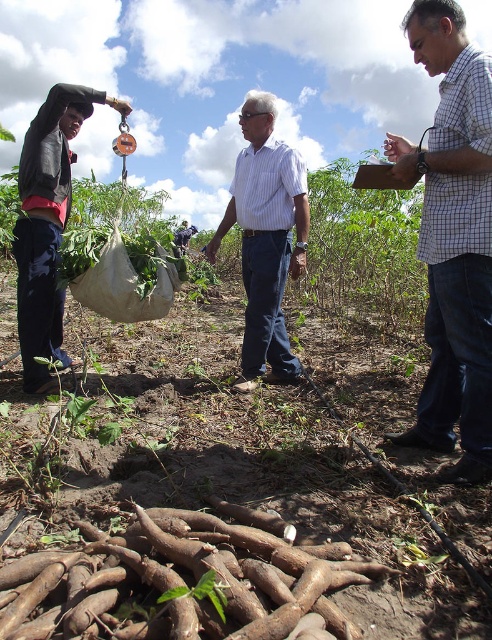
Question: Does brown rough root at lower center have a larger size compared to dark blue jeans at left?

Choices:
 (A) yes
 (B) no

Answer: (B)

Question: Which is farther from the white checkered shirt at center?

Choices:
 (A) light blue striped shirt at center
 (B) brown fabric bag at left
 (C) white striped shirt at center

Answer: (A)

Question: Among these objects, which one is farthest from the camera?

Choices:
 (A) light blue striped shirt at center
 (B) brown fabric bag at left

Answer: (A)

Question: Considering the relative positions of white checkered shirt at center and dark blue jeans at left in the image provided, where is white checkered shirt at center located with respect to dark blue jeans at left?

Choices:
 (A) below
 (B) above

Answer: (A)

Question: Which of these objects is positioned closest to the dark blue jeans at left?

Choices:
 (A) brown rough root at lower center
 (B) light blue striped shirt at center
 (C) white checkered shirt at center
 (D) white striped shirt at center

Answer: (D)

Question: Does brown rough root at lower center have a smaller size compared to light blue striped shirt at center?

Choices:
 (A) no
 (B) yes

Answer: (B)